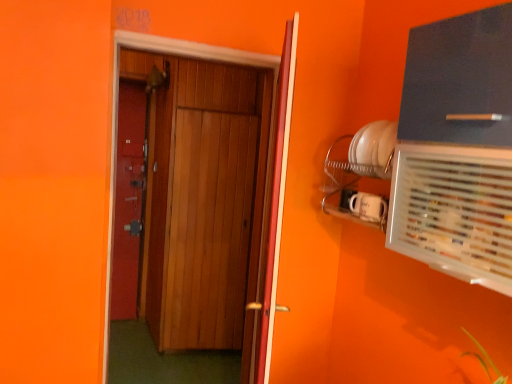
Question: Is wooden door at center, the 1th door viewed from the left, in front of or behind matte black cabinet at upper right in the image?

Choices:
 (A) front
 (B) behind

Answer: (B)

Question: Is wooden door at center, marked as the 2th door in a right-to-left arrangement, bigger or smaller than matte black cabinet at upper right?

Choices:
 (A) big
 (B) small

Answer: (A)

Question: Estimate the real-world distances between objects in this image. Which object is farther from the wooden door at center, placed as the second door when sorted from left to right?

Choices:
 (A) matte black cabinet at upper right
 (B) wooden door at center, the 1th door viewed from the left
 (C) clear plastic air conditioning at upper right

Answer: (B)

Question: Which of these objects is positioned closest to the wooden door at center, marked as the 2th door in a right-to-left arrangement?

Choices:
 (A) wooden door at center, the 1th door viewed from the right
 (B) clear plastic air conditioning at upper right
 (C) matte black cabinet at upper right

Answer: (A)